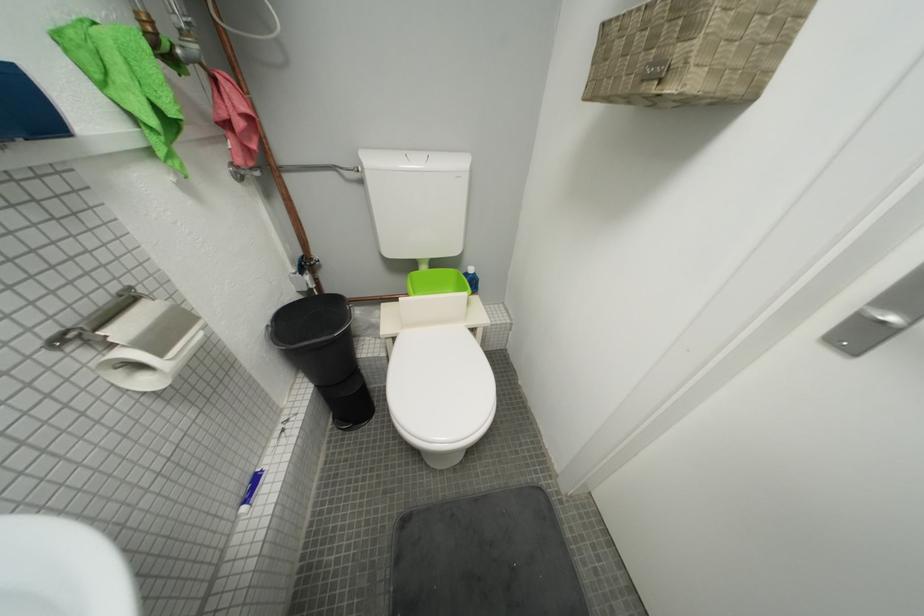
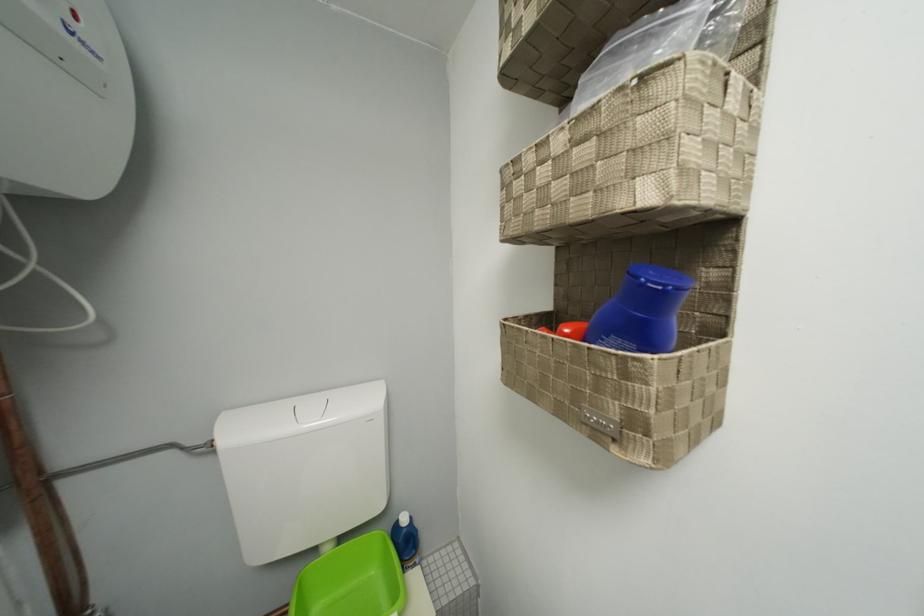
The point at (433,270) is marked in the first image. Where is the corresponding point in the second image?

(335, 552)